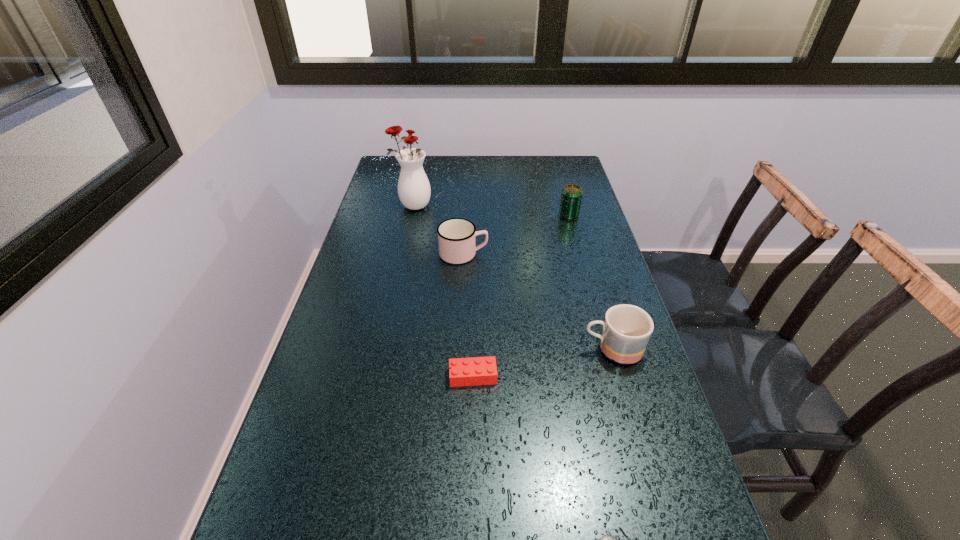
Identify which object is the fourth nearest to the nearest object. Please provide its 2D coordinates. Your answer should be formatted as a tuple, i.e. [(x, y)], where the tuple contains the x and y coordinates of a point satisfying the conditions above.

[(571, 198)]

Identify which object is located as the nearest to the fourth nearest object. Please provide its 2D coordinates. Your answer should be formatted as a tuple, i.e. [(x, y)], where the tuple contains the x and y coordinates of a point satisfying the conditions above.

[(414, 191)]

Where is `vacant area that satisfies the following two spatial constraints: 1. on the side of the left mug with the handle; 2. on the back side of the Lego`? The width and height of the screenshot is (960, 540). vacant area that satisfies the following two spatial constraints: 1. on the side of the left mug with the handle; 2. on the back side of the Lego is located at coordinates (458, 376).